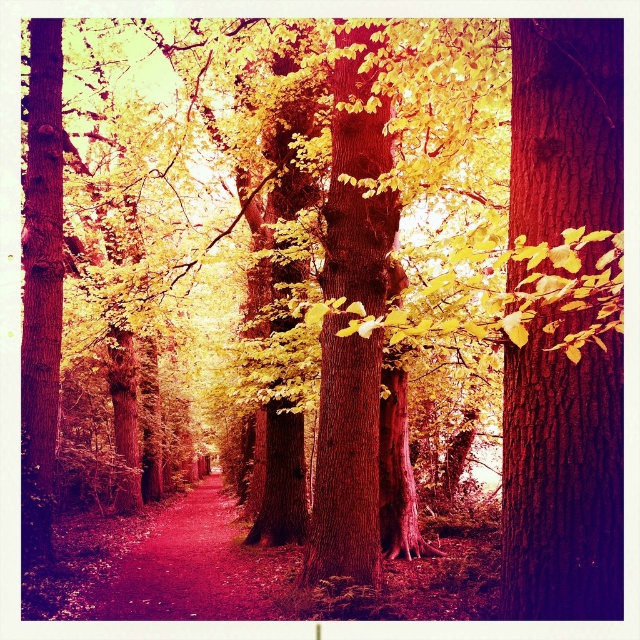
Is smooth bark tree at right closer to the viewer compared to smooth dirt path at center?

Yes, smooth bark tree at right is closer to the viewer.

Identify the location of smooth bark tree at right. (563, 476).